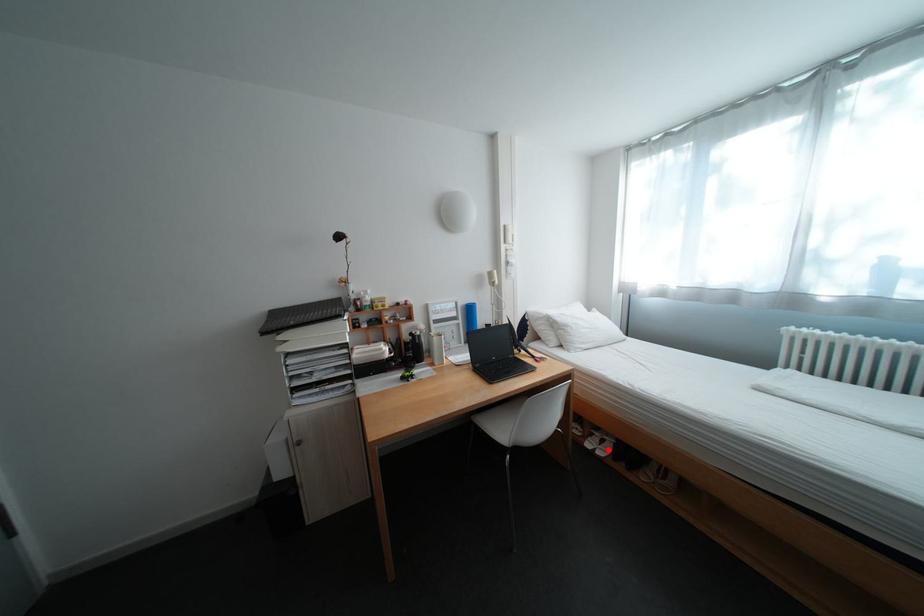
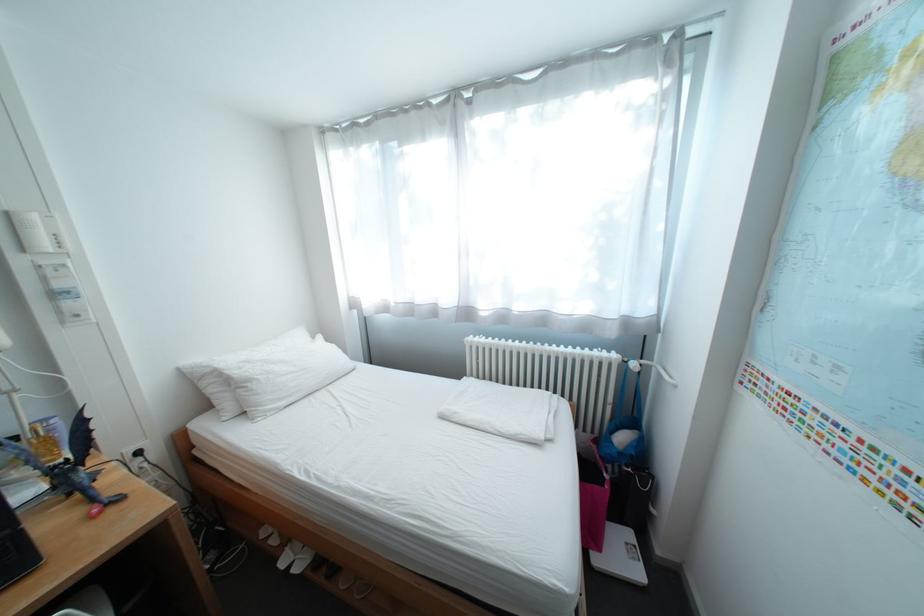
Question: I am providing you with two images of the same scene from different viewpoints. Given a red point in image1, look at the same physical point in image2. Is it:

Choices:
 (A) Closer to the viewpoint
 (B) Farther from the viewpoint

Answer: (A)